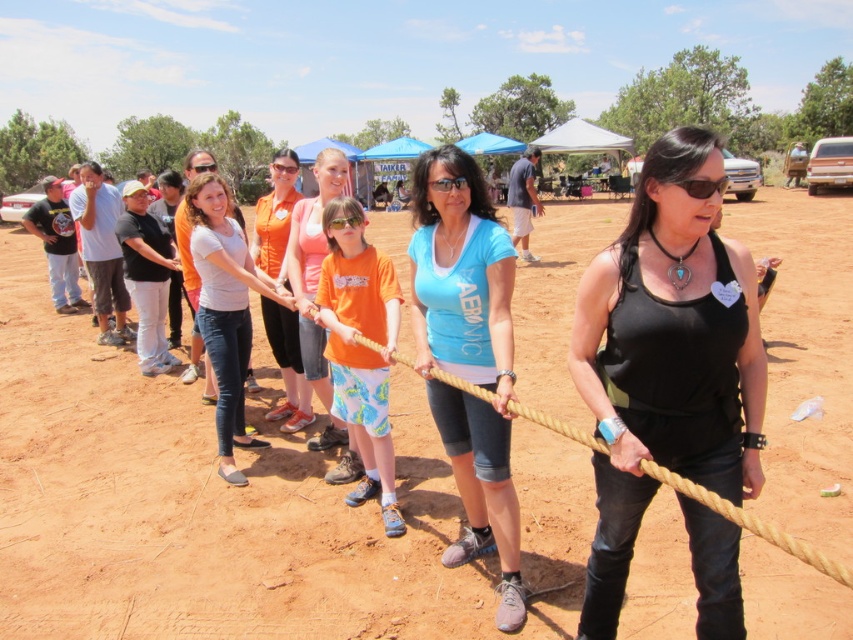
Question: Can you confirm if orange cotton shirt at center is positioned to the left of orange fabric shirt at center?

Choices:
 (A) no
 (B) yes

Answer: (A)

Question: Which point is farther to the camera?

Choices:
 (A) (222, 250)
 (B) (335, 161)
 (C) (682, 163)
 (D) (468, 387)

Answer: (A)

Question: Can you confirm if white cotton shirt at center is positioned below orange fabric shirt at center?

Choices:
 (A) yes
 (B) no

Answer: (A)

Question: Observing the image, what is the correct spatial positioning of black leather tank top at center in reference to orange cotton shirt at center?

Choices:
 (A) left
 (B) right

Answer: (B)

Question: Among these points, which one is farthest from the camera?

Choices:
 (A) (416, 365)
 (B) (305, 234)
 (C) (799, 212)
 (D) (683, 339)

Answer: (C)

Question: Which object is positioned farthest from the white cotton shirt at center?

Choices:
 (A) orange cotton shirt at center
 (B) brown dirt field at center
 (C) matte blue t-shirt at center

Answer: (B)